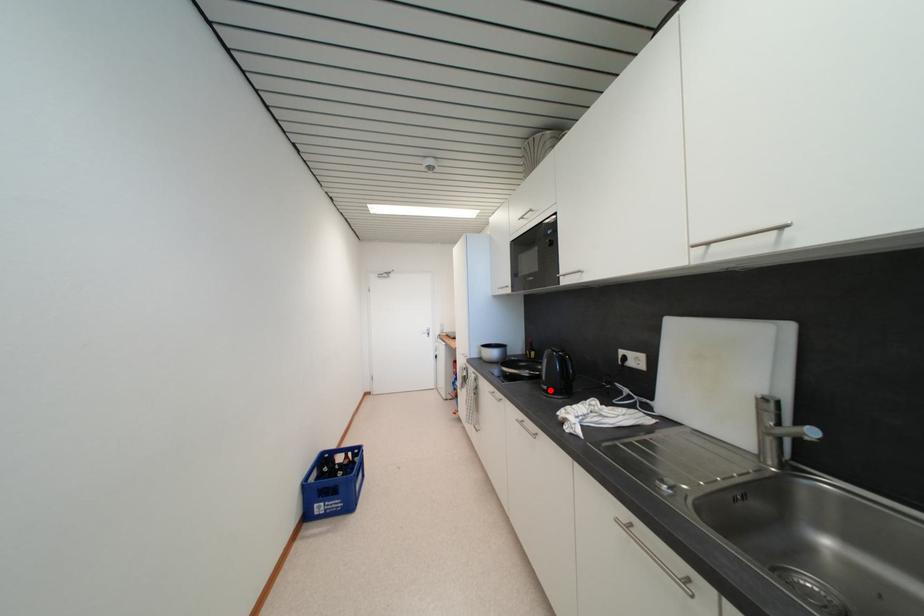
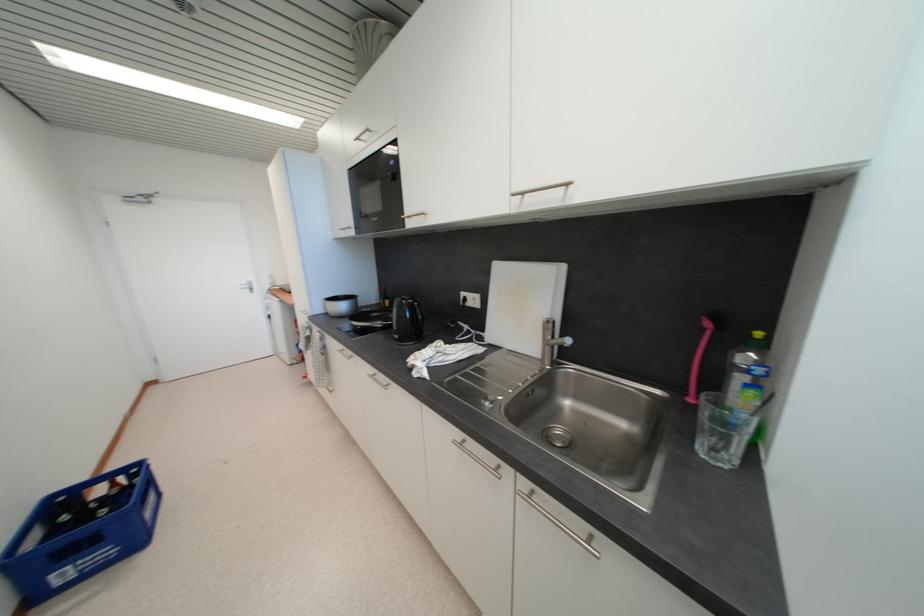
In the second image, find the point that corresponds to the highlighted location in the first image.

(402, 339)